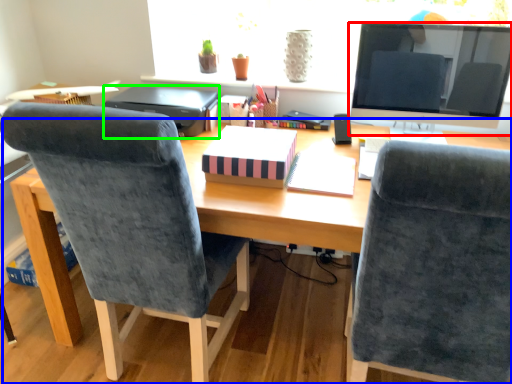
Question: Which is farther away from television (highlighted by a red box)? desk (highlighted by a blue box) or printer (highlighted by a green box)?

Choices:
 (A) desk
 (B) printer

Answer: (B)